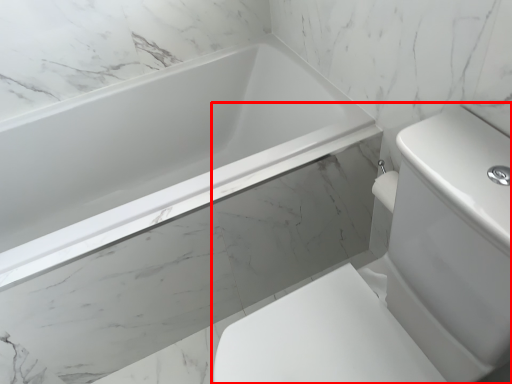
Question: Observing the image, what is the correct spatial positioning of sink (annotated by the red box) in reference to bathtub?

Choices:
 (A) right
 (B) left

Answer: (A)